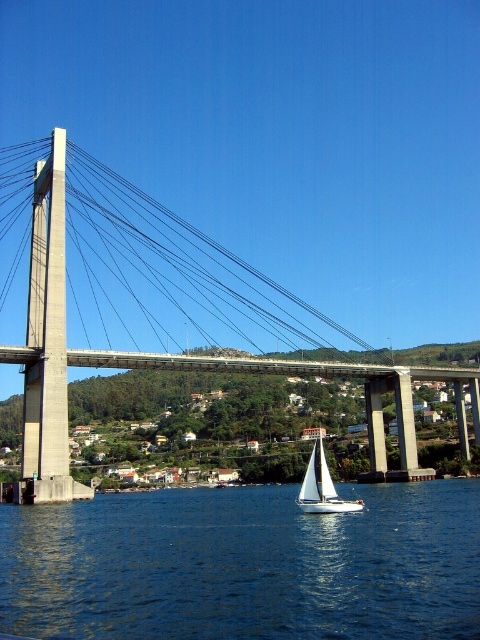
Question: Is blue liquid water at center bigger than white sailboat at center?

Choices:
 (A) no
 (B) yes

Answer: (B)

Question: Which of the following is the farthest from the observer?

Choices:
 (A) white sailboat at center
 (B) blue liquid water at center

Answer: (A)

Question: Does blue liquid water at center have a greater width compared to concrete suspension bridge at center?

Choices:
 (A) no
 (B) yes

Answer: (A)

Question: Considering the real-world distances, which object is farthest from the white sailboat at center?

Choices:
 (A) blue liquid water at center
 (B) concrete suspension bridge at center

Answer: (B)

Question: Which object is the closest to the blue liquid water at center?

Choices:
 (A) concrete suspension bridge at center
 (B) white sailboat at center

Answer: (B)

Question: Can you confirm if concrete suspension bridge at center is bigger than white sailboat at center?

Choices:
 (A) no
 (B) yes

Answer: (B)